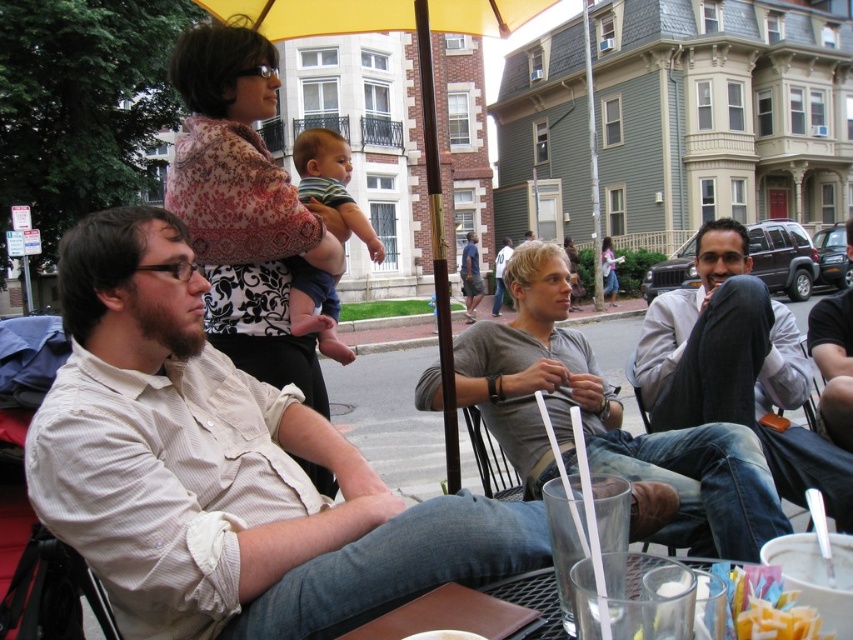
Between gray cotton shirt at center and light gray sweater at right, which one is positioned higher?

light gray sweater at right is higher up.

Between point (759, 458) and point (683, 353), which one is positioned behind?

Positioned behind is point (683, 353).

The width and height of the screenshot is (853, 640). What are the coordinates of `gray cotton shirt at center` in the screenshot? It's located at (606, 420).

Is point (708, 470) in front of point (219, 180)?

That is True.

Which is above, gray cotton shirt at center or floral-patterned blouse at upper left?

Positioned higher is floral-patterned blouse at upper left.

Locate an element on the screen. The width and height of the screenshot is (853, 640). gray cotton shirt at center is located at coordinates (606, 420).

Identify the location of gray cotton shirt at center. This screenshot has height=640, width=853. (606, 420).

Is light beige shirt at center further to camera compared to clear glass at lower center?

Yes.

Between light beige shirt at center and clear glass at lower center, which one has less height?

clear glass at lower center is shorter.

Identify the location of light beige shirt at center. Image resolution: width=853 pixels, height=640 pixels. (224, 468).